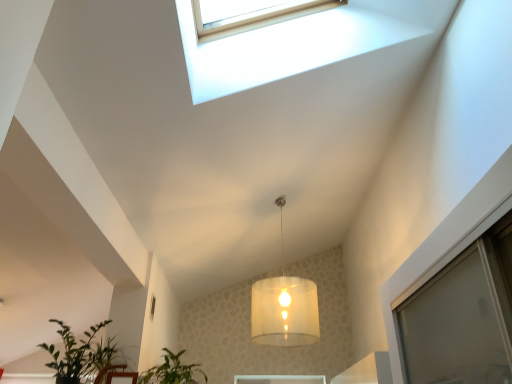
Question: Is green leafy plant at lower center, the first houseplant in the right-to-left sequence, completely or partially inside translucent fabric lampshade at center?

Choices:
 (A) yes
 (B) no

Answer: (B)

Question: Can you confirm if translucent fabric lampshade at center is positioned to the left of green leafy plant at lower center, the first houseplant in the right-to-left sequence?

Choices:
 (A) yes
 (B) no

Answer: (B)

Question: From a real-world perspective, is translucent fabric lampshade at center on green leafy plant at lower center, which ranks as the 2th houseplant in left-to-right order?

Choices:
 (A) yes
 (B) no

Answer: (A)

Question: Is translucent fabric lampshade at center shorter than green leafy plant at lower center, the first houseplant in the right-to-left sequence?

Choices:
 (A) no
 (B) yes

Answer: (A)

Question: Is translucent fabric lampshade at center taller than green leafy plant at lower center, the first houseplant in the right-to-left sequence?

Choices:
 (A) yes
 (B) no

Answer: (A)

Question: Is translucent fabric lampshade at center wider than green leafy plant at lower center, which ranks as the 2th houseplant in left-to-right order?

Choices:
 (A) no
 (B) yes

Answer: (B)

Question: From the image's perspective, would you say green leafy plant at lower center, the first houseplant in the right-to-left sequence, is positioned over green leafy plant at lower left, which is counted as the 2th houseplant, starting from the right?

Choices:
 (A) no
 (B) yes

Answer: (A)

Question: Can you confirm if green leafy plant at lower center, the first houseplant in the right-to-left sequence, is bigger than green leafy plant at lower left, the first houseplant viewed from the left?

Choices:
 (A) no
 (B) yes

Answer: (A)

Question: Does green leafy plant at lower center, which ranks as the 2th houseplant in left-to-right order, have a lesser height compared to green leafy plant at lower left, the first houseplant viewed from the left?

Choices:
 (A) yes
 (B) no

Answer: (A)

Question: Is green leafy plant at lower center, which ranks as the 2th houseplant in left-to-right order, thinner than green leafy plant at lower left, which is counted as the 2th houseplant, starting from the right?

Choices:
 (A) yes
 (B) no

Answer: (A)

Question: From the image's perspective, is green leafy plant at lower center, the first houseplant in the right-to-left sequence, below green leafy plant at lower left, which is counted as the 2th houseplant, starting from the right?

Choices:
 (A) no
 (B) yes

Answer: (B)

Question: Can you confirm if green leafy plant at lower center, the first houseplant in the right-to-left sequence, is wider than green leafy plant at lower left, which is counted as the 2th houseplant, starting from the right?

Choices:
 (A) no
 (B) yes

Answer: (A)

Question: Does green leafy plant at lower left, the first houseplant viewed from the left, have a smaller size compared to translucent fabric lampshade at center?

Choices:
 (A) yes
 (B) no

Answer: (A)